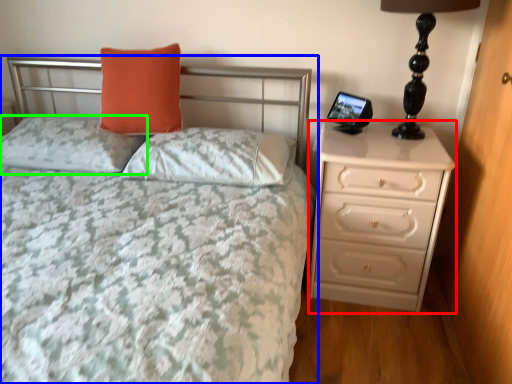
Question: Which object is positioned farthest from chest of drawers (highlighted by a red box)? Select from bed (highlighted by a blue box) and pillow (highlighted by a green box).

Choices:
 (A) bed
 (B) pillow

Answer: (B)